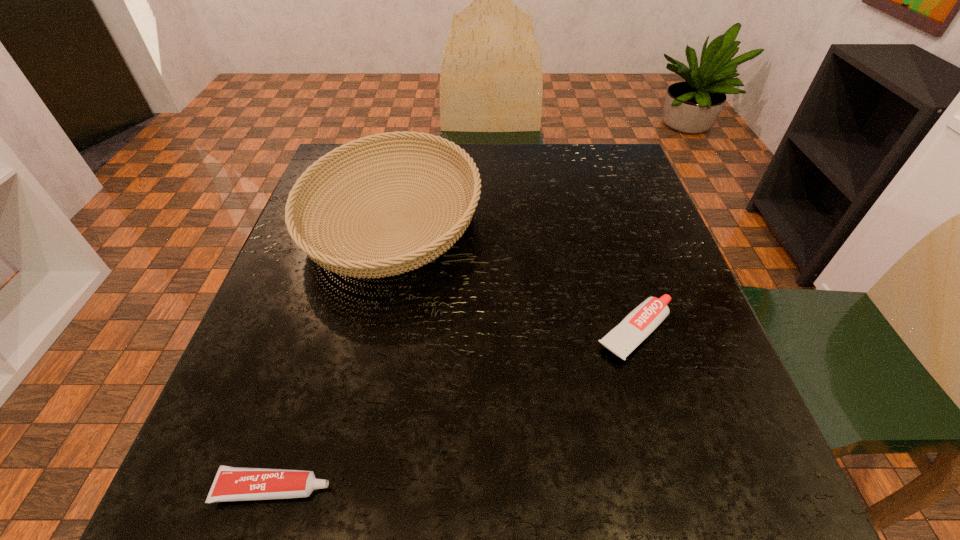
The width and height of the screenshot is (960, 540). I want to click on object that is at the near edge, so click(x=231, y=483).

At what (x,y) coordinates should I click in order to perform the action: click on basket that is at the left edge. Please return your answer as a coordinate pair (x, y). The height and width of the screenshot is (540, 960). Looking at the image, I should click on (406, 257).

In order to click on toothpaste that is at the left edge in this screenshot , I will do `click(231, 483)`.

This screenshot has width=960, height=540. Find the location of `object that is at the right edge`. object that is at the right edge is located at coordinates (644, 319).

Locate an element on the screen. The width and height of the screenshot is (960, 540). object situated at the far left corner is located at coordinates (406, 257).

The height and width of the screenshot is (540, 960). Identify the location of object that is at the near left corner. (231, 483).

Identify the location of free space at the far edge of the desktop. The image size is (960, 540). (541, 183).

Where is `free space at the right edge of the desktop`? free space at the right edge of the desktop is located at coordinates (641, 240).

Identify the location of vacant area at the near left corner. Image resolution: width=960 pixels, height=540 pixels. (304, 454).

In the image, there is a desktop. Where is `vacant space at the far right corner`? This screenshot has height=540, width=960. vacant space at the far right corner is located at coordinates (594, 158).